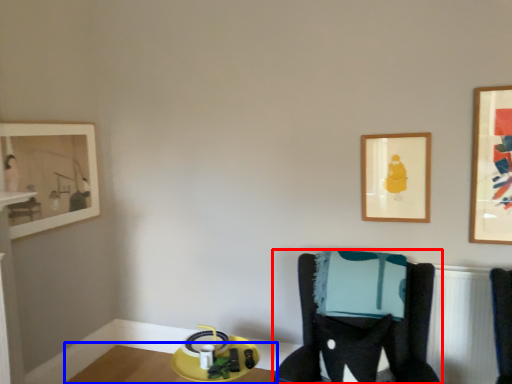
Question: Which object appears closest to the camera in this image, furniture (highlighted by a red box) or table (highlighted by a blue box)?

Choices:
 (A) furniture
 (B) table

Answer: (A)